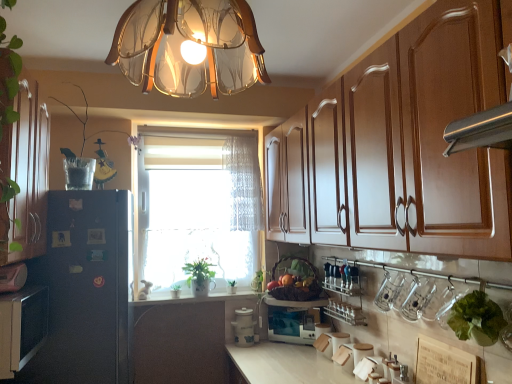
Locate an element on the screen. This screenshot has width=512, height=384. free space above white glossy counter top at center (from a real-world perspective) is located at coordinates (197, 296).